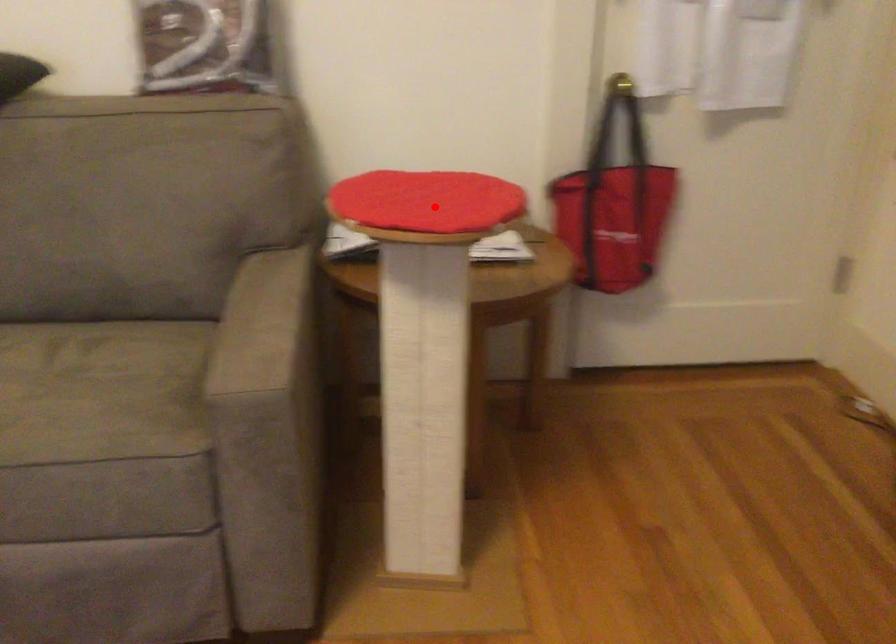
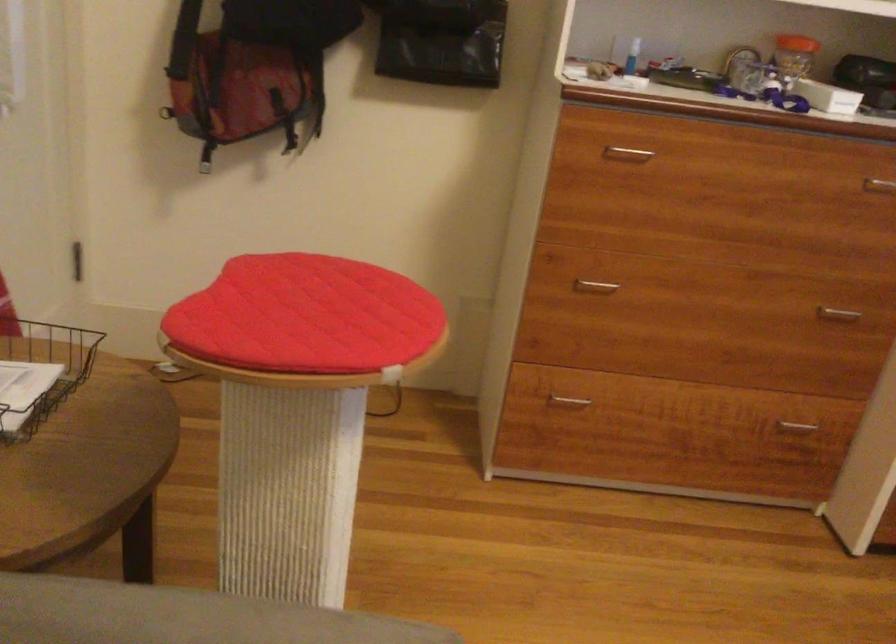
The point at the highlighted location is marked in the first image. Where is the corresponding point in the second image?

(306, 316)